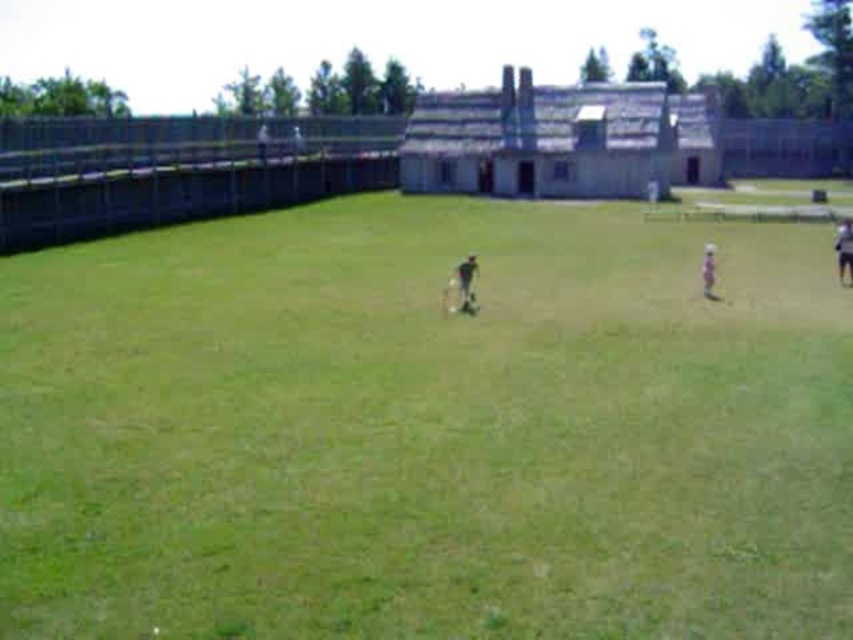
You are standing at the origin point of the image coordinate system. The origin is at the bottom left corner of the image. You want to walk to the green grass at center. Which direction should you walk? Please answer with a direction like north, south, east, west, northeast, etc.

The green grass at center is located at coordinate point (426, 428). Since the origin is at the bottom left corner, the x increases to the right and y increases upward. The green grass at center has an x value of 0.670, which is to the right of the origin, and a y value of 0.501, which is halfway up the image. Therefore, you should walk northeast to reach the green grass at center.

You are standing at the origin point of the coordinate system, which is the bottom left corner of the image. You want to locate the light brown fabric person at center. What are their coordinates?

The coordinates of the light brown fabric person at center are at point (708,272).